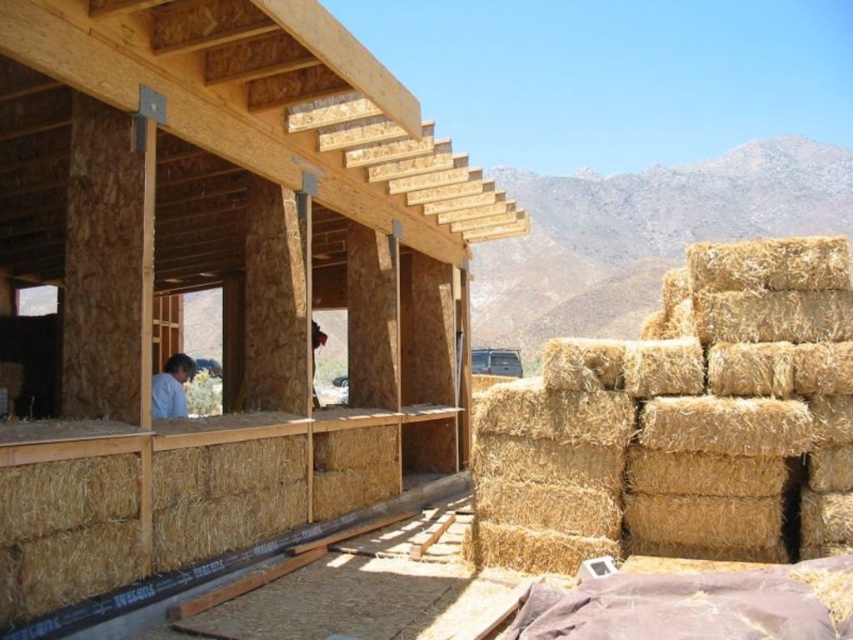
You are a worker on a construction site and need to place a tool on the ground near the light blue shirt at lower left without it being under the natural straw bales at right. Is this possible?

The natural straw bales at right is located above light blue shirt at lower left, so placing the tool on the ground near the light blue shirt at lower left would not be under the natural straw bales at right. Yes, it is possible.

You are standing at the center of the construction site and want to move to the natural straw bales at right. Which direction should you move to reach them?

The natural straw bales at right are located at point (219, 276), so you should move to the right to reach them.